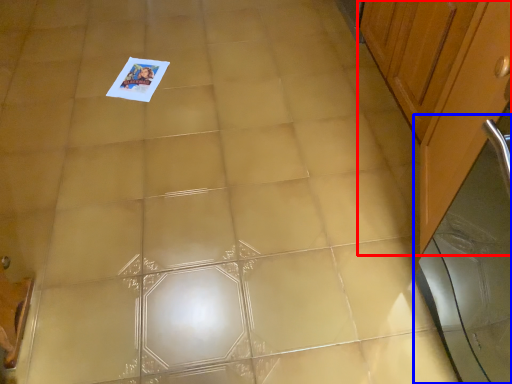
Question: Which point is closer to the camera, cabinetry (highlighted by a red box) or screen door (highlighted by a blue box)?

Choices:
 (A) cabinetry
 (B) screen door

Answer: (B)